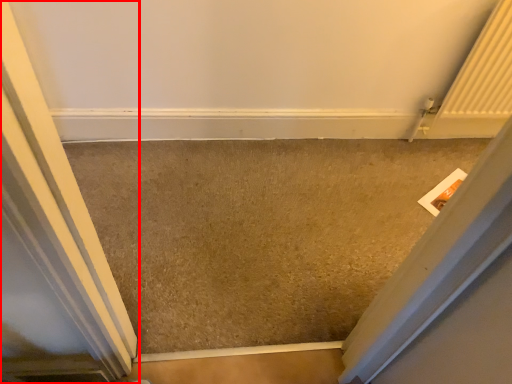
Question: Considering the relative positions of door (annotated by the red box) and concrete in the image provided, where is door (annotated by the red box) located with respect to the staircase?

Choices:
 (A) left
 (B) right

Answer: (A)